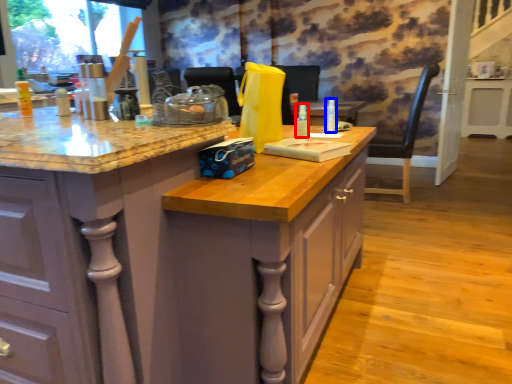
Question: Which object appears farthest to the camera in this image, bottle (highlighted by a red box) or bottle (highlighted by a blue box)?

Choices:
 (A) bottle
 (B) bottle

Answer: (B)